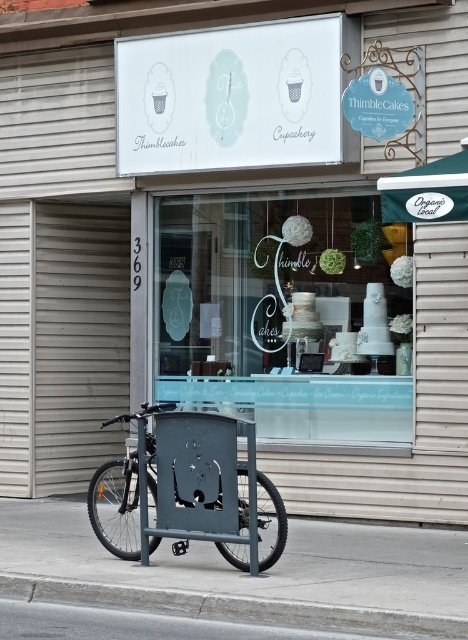
You are a customer approaching the entrance of ThimbleCakes bakery. You see the clear glass window at center and the metallic bicycle at lower left. Which object is closer to your right side as you face the entrance?

The clear glass window at center is to the right of the metallic bicycle at lower left, so as you face the entrance, the clear glass window at center will be closer to your right side.

You are standing in front of the bakery storefront. There is a point at coordinates (116, 506). What object is this point located on?

The point at coordinates (116, 506) is located on the metallic bicycle at lower left.

You are a delivery person arriving at ThimbleCakes bakery. You need to enter the store but your bicycle is blocking the entrance. The entrance is located where the clear glass window at center is. Can you move your metallic bicycle at lower left to the side without obstructing the entrance?

The clear glass window at center is bigger than metallic bicycle at lower left, so the entrance is larger than the bicycle. You can move the metallic bicycle at lower left to the side without blocking the entrance since the entrance is bigger.